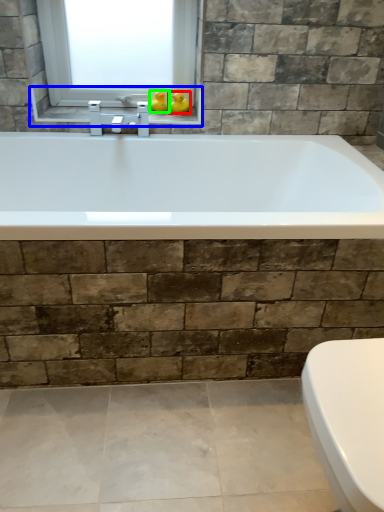
Question: Which is nearer to the duck (highlighted by a red box)? window sill (highlighted by a blue box) or duck (highlighted by a green box).

Choices:
 (A) window sill
 (B) duck

Answer: (B)